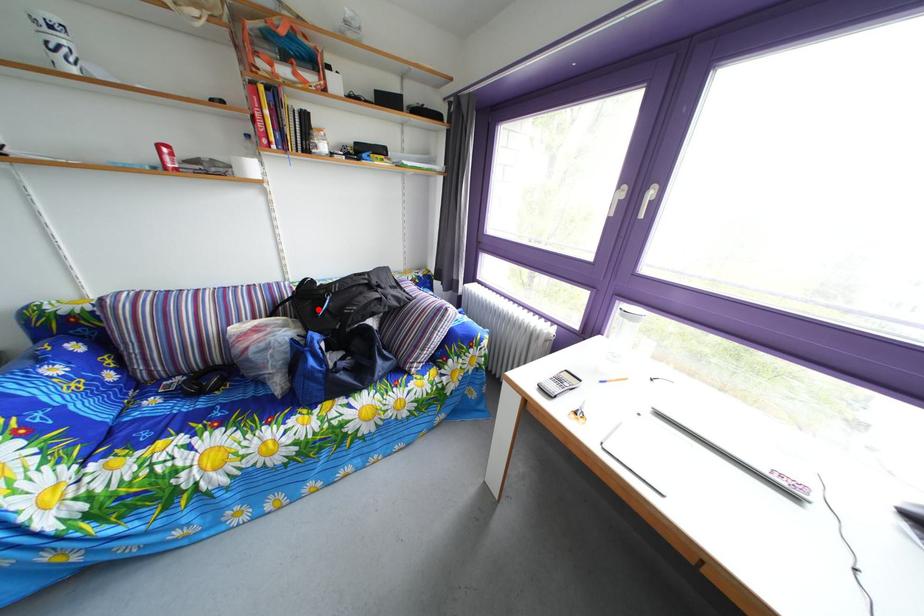
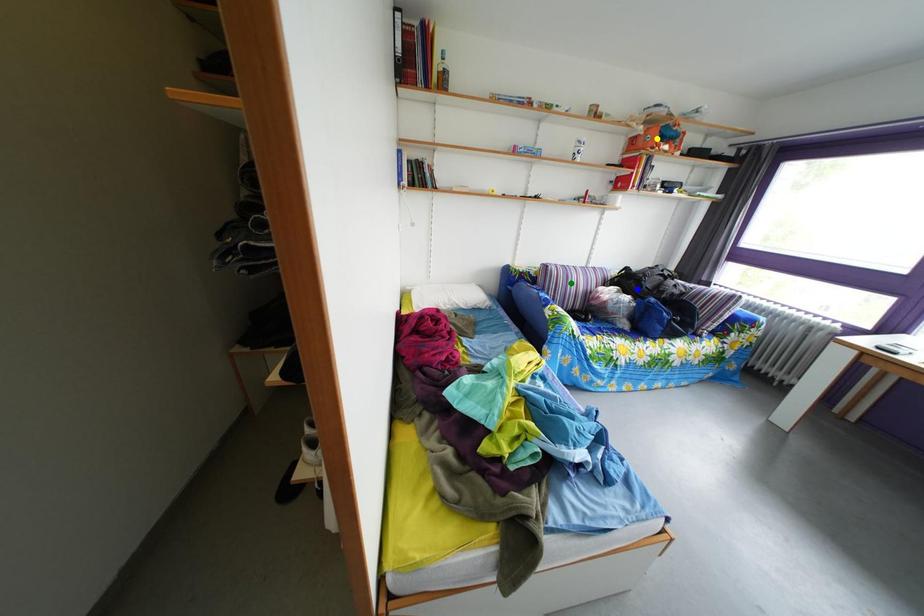
Question: I am providing you with two images of the same scene from different viewpoints. A red point is marked on the first image. You are given multiple points on the second image. In image 2, which mark is for the same physical point as the one in image 1?

Choices:
 (A) green point
 (B) blue point
 (C) yellow point

Answer: (B)